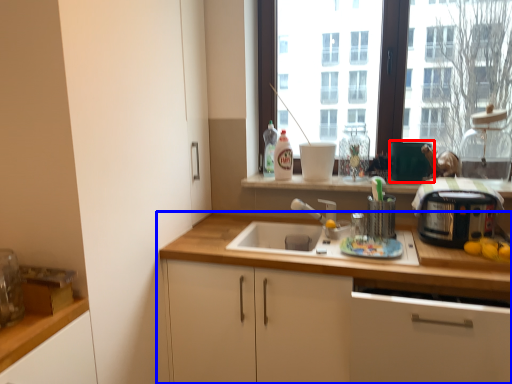
Question: Which object is further to the camera taking this photo, appliance (highlighted by a red box) or cabinetry (highlighted by a blue box)?

Choices:
 (A) appliance
 (B) cabinetry

Answer: (A)